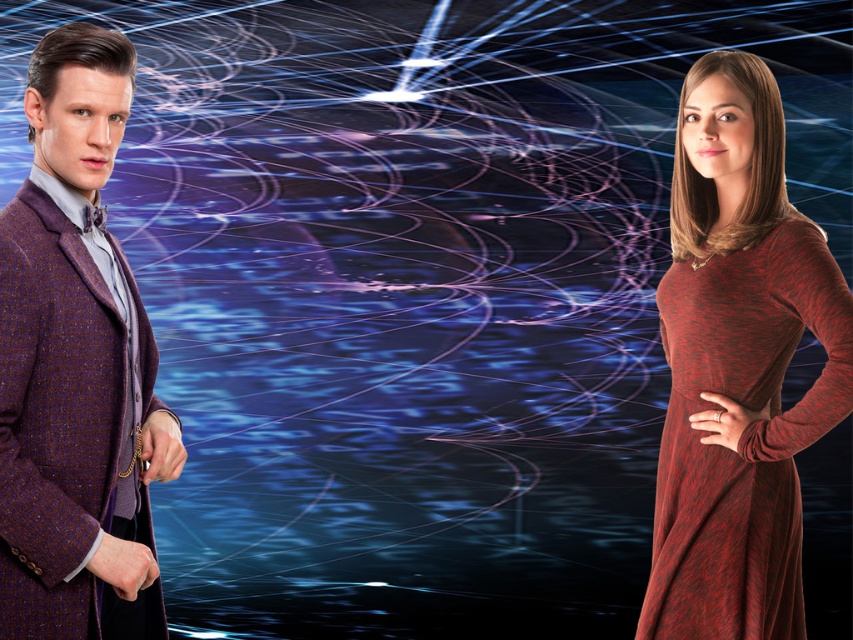
Question: Is plush wool coat at left further to the viewer compared to maroon knit dress at right?

Choices:
 (A) no
 (B) yes

Answer: (A)

Question: Which object is closer to the camera taking this photo?

Choices:
 (A) plush wool coat at left
 (B) maroon knit dress at right

Answer: (A)

Question: Among these points, which one is nearest to the camera?

Choices:
 (A) (47, 156)
 (B) (766, 276)

Answer: (A)

Question: From the image, what is the correct spatial relationship of plush wool coat at left in relation to maroon knit dress at right?

Choices:
 (A) above
 (B) below

Answer: (A)

Question: Is the position of plush wool coat at left less distant than that of maroon knit dress at right?

Choices:
 (A) no
 (B) yes

Answer: (B)

Question: Which point is farther to the camera?

Choices:
 (A) (32, 310)
 (B) (762, 428)

Answer: (B)